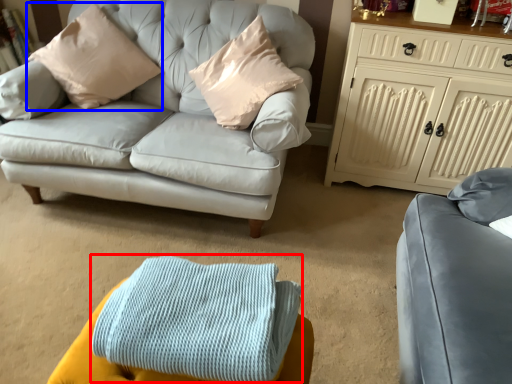
Question: Among these objects, which one is farthest to the camera, blanket (highlighted by a red box) or pillow (highlighted by a blue box)?

Choices:
 (A) blanket
 (B) pillow

Answer: (B)